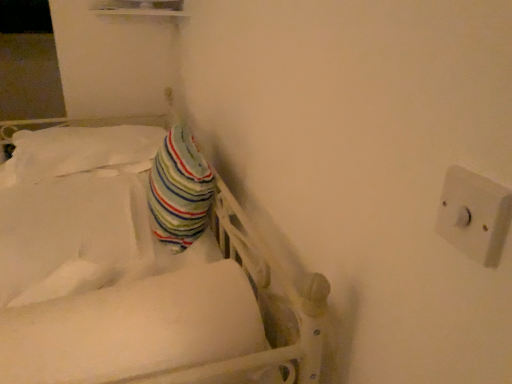
Question: Does striped fabric pillow at upper left have a greater width compared to white soft mattress at center?

Choices:
 (A) no
 (B) yes

Answer: (B)

Question: Is striped fabric pillow at upper left closer to camera compared to white soft mattress at center?

Choices:
 (A) yes
 (B) no

Answer: (B)

Question: Is there a large distance between striped fabric pillow at upper left and white soft mattress at center?

Choices:
 (A) no
 (B) yes

Answer: (B)

Question: Is striped fabric pillow at upper left with white soft mattress at center?

Choices:
 (A) no
 (B) yes

Answer: (A)

Question: Does striped fabric pillow at upper left have a larger size compared to white soft mattress at center?

Choices:
 (A) yes
 (B) no

Answer: (A)

Question: From the image's perspective, is striped fabric pillow at upper left positioned above or below white soft mattress at center?

Choices:
 (A) above
 (B) below

Answer: (A)

Question: Is point (64, 150) positioned closer to the camera than point (38, 365)?

Choices:
 (A) closer
 (B) farther

Answer: (B)

Question: From their relative heights in the image, would you say striped fabric pillow at upper left is taller or shorter than white soft mattress at center?

Choices:
 (A) tall
 (B) short

Answer: (B)

Question: Is striped fabric pillow at upper left wider or thinner than white soft mattress at center?

Choices:
 (A) thin
 (B) wide

Answer: (B)

Question: Considering the positions of point pos(153,129) and point pos(478,188), is point pos(153,129) closer or farther from the camera than point pos(478,188)?

Choices:
 (A) farther
 (B) closer

Answer: (A)

Question: Relative to white plastic switch at upper right, is striped fabric pillow at upper left in front or behind?

Choices:
 (A) front
 (B) behind

Answer: (B)

Question: From their relative heights in the image, would you say striped fabric pillow at upper left is taller or shorter than white plastic switch at upper right?

Choices:
 (A) short
 (B) tall

Answer: (B)

Question: From a real-world perspective, is striped fabric pillow at upper left above or below white plastic switch at upper right?

Choices:
 (A) below
 (B) above

Answer: (A)

Question: Considering their positions, is striped fabric pillow at center located in front of or behind white plastic switch at upper right?

Choices:
 (A) behind
 (B) front

Answer: (A)

Question: Is striped fabric pillow at center wider or thinner than white plastic switch at upper right?

Choices:
 (A) wide
 (B) thin

Answer: (A)